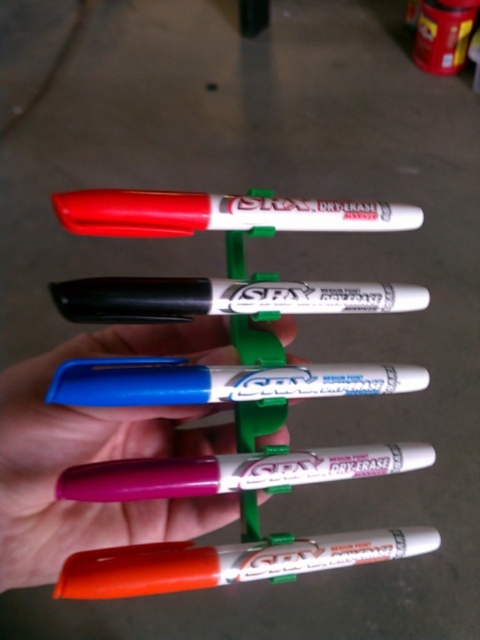
Is purple matte marker at center thinner than white glossy marker at center?

Correct, purple matte marker at center's width is less than white glossy marker at center's.

Locate an element on the screen. The height and width of the screenshot is (640, 480). purple matte marker at center is located at coordinates (100, 452).

Can you confirm if purple matte marker at center is bigger than matte white marker at center?

Indeed, purple matte marker at center has a larger size compared to matte white marker at center.

Between purple matte marker at center and matte white marker at center, which one is positioned higher?

Positioned higher is matte white marker at center.

The image size is (480, 640). What do you see at coordinates (100, 452) in the screenshot?
I see `purple matte marker at center` at bounding box center [100, 452].

At what (x,y) coordinates should I click in order to perform the action: click on purple matte marker at center. Please return your answer as a coordinate pair (x, y). This screenshot has height=640, width=480. Looking at the image, I should click on (100, 452).

Between blue glossy marker at center and matte purple marker at center, which one is positioned lower?

matte purple marker at center is below.

Find the location of `blue glossy marker at center`. blue glossy marker at center is located at coordinates (218, 381).

Describe the element at coordinates (218, 381) in the screenshot. I see `blue glossy marker at center` at that location.

The width and height of the screenshot is (480, 640). I want to click on blue glossy marker at center, so click(x=218, y=381).